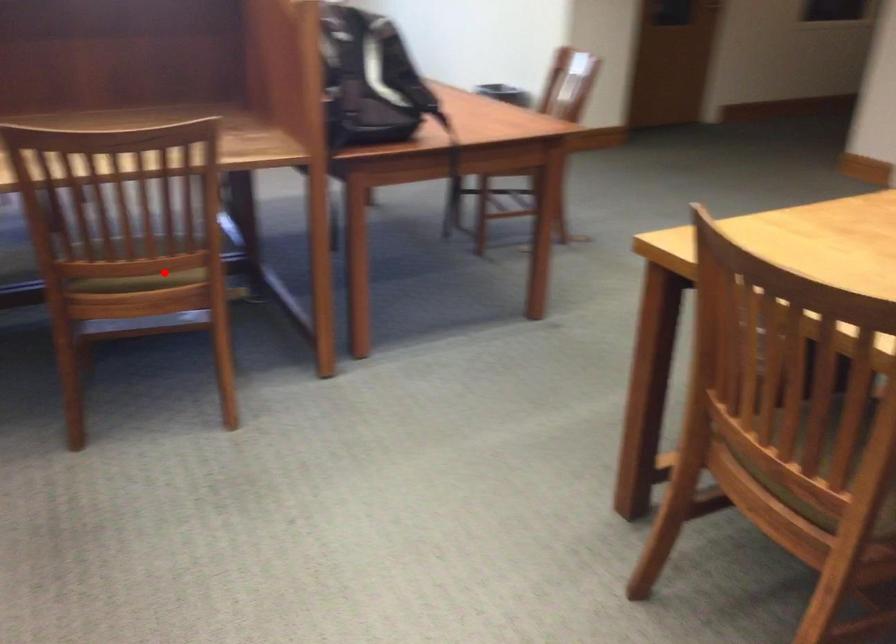
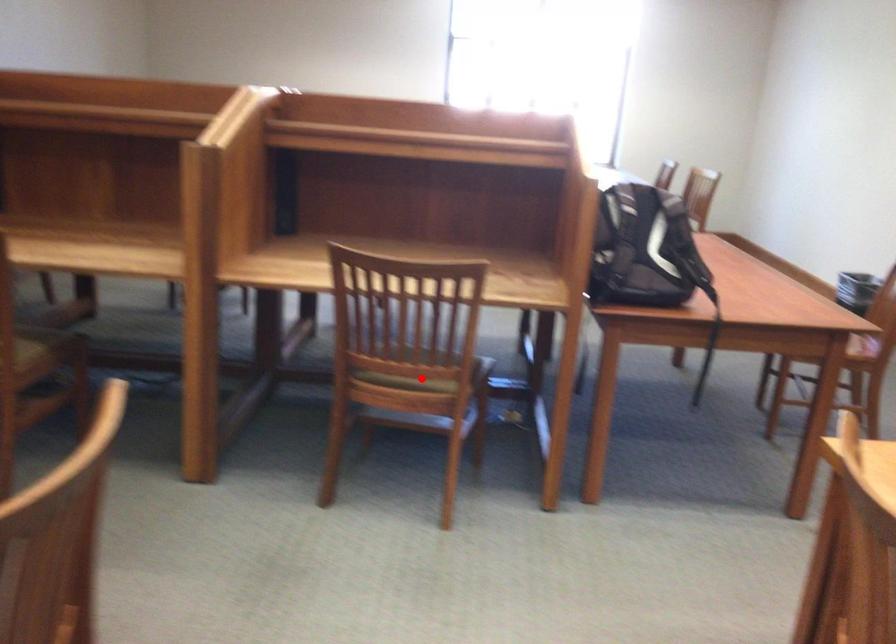
I am providing you with two images of the same scene from different viewpoints. A red point is marked on the first image and another point is marked on the second image. Is the red point in image1 aligned with the point shown in image2?

Yes